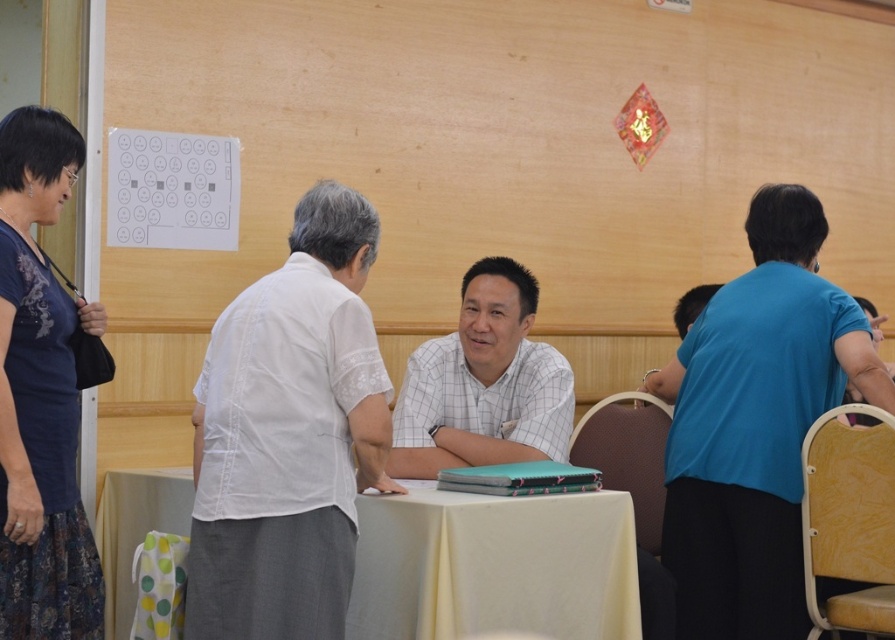
Does dark blue fabric dress at left have a greater width compared to white checkered shirt at center?

No, dark blue fabric dress at left is not wider than white checkered shirt at center.

Between point (16, 310) and point (567, 371), which one is positioned in front?

Positioned in front is point (16, 310).

The height and width of the screenshot is (640, 895). Find the location of `dark blue fabric dress at left`. dark blue fabric dress at left is located at coordinates (40, 396).

Based on the photo, can you confirm if white cotton shirt at center is positioned below yellow fabric table at center?

No.

Which is above, white cotton shirt at center or yellow fabric table at center?

white cotton shirt at center

Where is `white cotton shirt at center`? white cotton shirt at center is located at coordinates (288, 435).

In order to click on white cotton shirt at center in this screenshot , I will do `click(288, 435)`.

Is the position of yellow fabric table at center more distant than that of white checkered shirt at center?

That is False.

Can you confirm if yellow fabric table at center is taller than white checkered shirt at center?

Incorrect, yellow fabric table at center's height is not larger of white checkered shirt at center's.

The height and width of the screenshot is (640, 895). Describe the element at coordinates (493, 564) in the screenshot. I see `yellow fabric table at center` at that location.

Locate an element on the screen. The height and width of the screenshot is (640, 895). yellow fabric table at center is located at coordinates (493, 564).